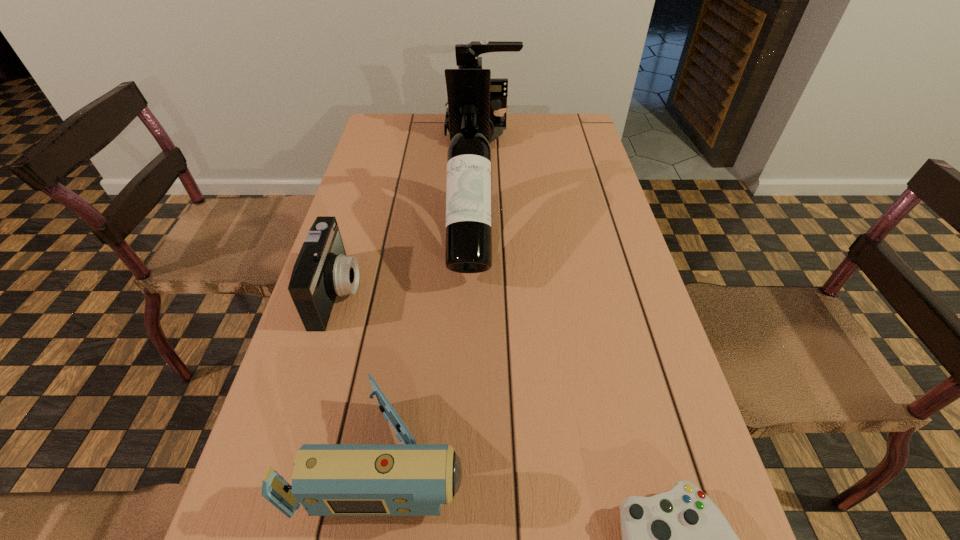
Where is `wine bottle`? This screenshot has width=960, height=540. wine bottle is located at coordinates (468, 242).

This screenshot has height=540, width=960. What are the coordinates of `the tallest camcorder` in the screenshot? It's located at (467, 55).

Where is `the farthest object`? the farthest object is located at coordinates (467, 55).

Where is `the nearest camcorder`? the nearest camcorder is located at coordinates (409, 479).

The image size is (960, 540). I want to click on the second nearest camcorder, so click(322, 271).

Locate an element on the screen. vacant area situated on the stand of the tallest object is located at coordinates (466, 457).

This screenshot has width=960, height=540. I want to click on vacant area situated on the lens mount of the tallest camcorder, so click(x=418, y=134).

What are the coordinates of `vacant space located on the lens mount of the tallest camcorder` in the screenshot? It's located at (374, 134).

Identify the location of vacant space situated on the lens mount of the tallest camcorder. (380, 134).

Locate an element on the screen. vacant space located on the side of the nearest camcorder with the flip-out screen is located at coordinates (673, 457).